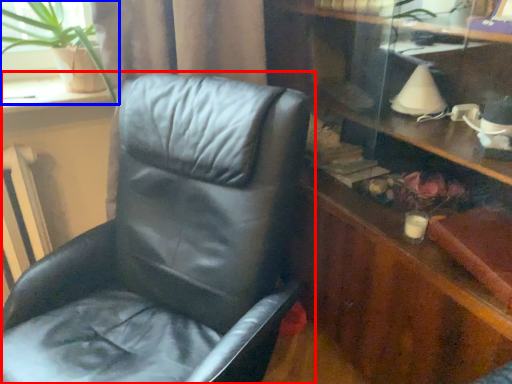
Question: Which point is further to the camera, chair (highlighted by a red box) or houseplant (highlighted by a blue box)?

Choices:
 (A) chair
 (B) houseplant

Answer: (B)